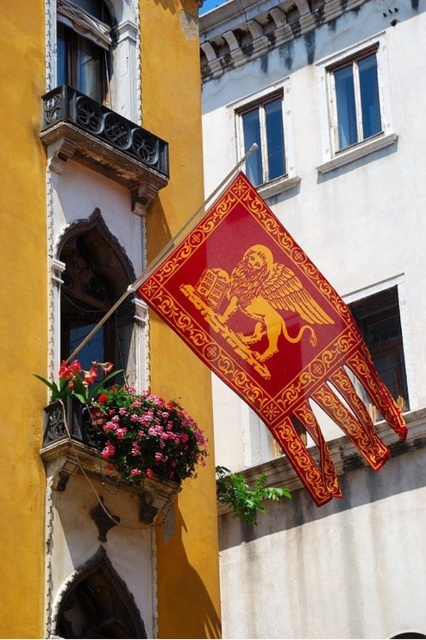
Between pink fabric flower at lower left and wooden flower box at lower left, which one has more height?

wooden flower box at lower left

Is pink fabric flower at lower left to the left of wooden flower box at lower left from the viewer's perspective?

No, pink fabric flower at lower left is not to the left of wooden flower box at lower left.

Which is in front, point (158, 442) or point (69, 422)?

Point (69, 422)

Where is `pink fabric flower at lower left`? The height and width of the screenshot is (640, 426). pink fabric flower at lower left is located at coordinates (146, 435).

Is shiny red fabric flag at center shorter than wooden flower box at lower left?

No, shiny red fabric flag at center is not shorter than wooden flower box at lower left.

Between shiny red fabric flag at center and wooden flower box at lower left, which one has less height?

Standing shorter between the two is wooden flower box at lower left.

Is point (298, 250) closer to camera compared to point (152, 513)?

No.

Identify the location of shiny red fabric flag at center. This screenshot has width=426, height=640. pyautogui.click(x=273, y=332).

Is the position of shiny red fabric flag at center less distant than that of pink fabric flower at lower left?

That is True.

Can you confirm if shiny red fabric flag at center is shorter than pink fabric flower at lower left?

No, shiny red fabric flag at center is not shorter than pink fabric flower at lower left.

Where is `shiny red fabric flag at center`? shiny red fabric flag at center is located at coordinates (273, 332).